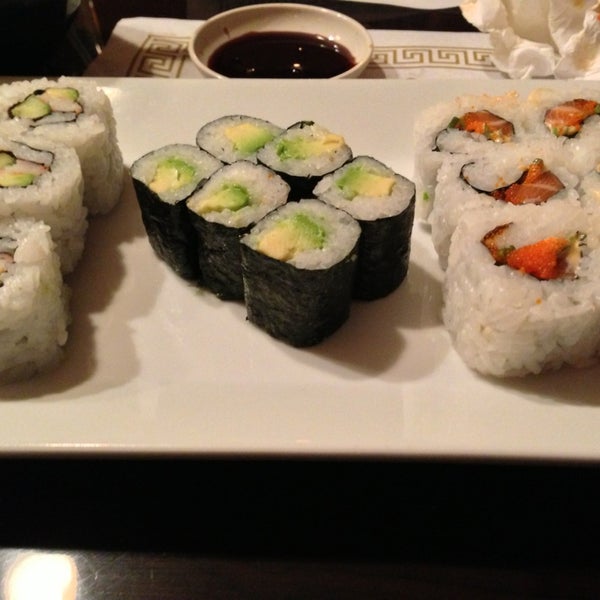
You are a GUI agent. You are given a task and a screenshot of the screen. Output one action in this format:
    pyautogui.click(x=<x>, y=<y>)
    Task: Click on the countertop or table
    The image size is (600, 600).
    Given the screenshot: What is the action you would take?
    pyautogui.click(x=201, y=393)